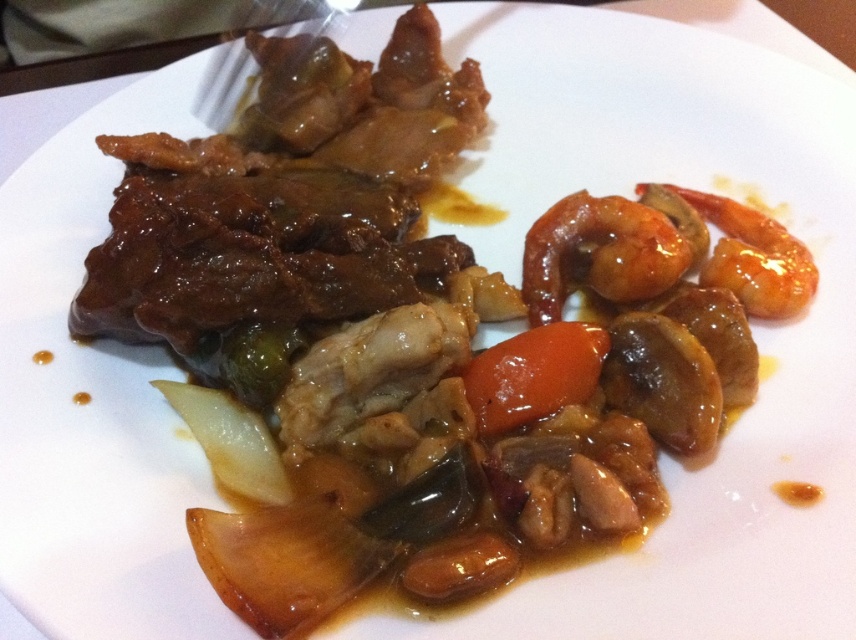
Question: In this image, where is glossy orange shrimp at upper right located relative to glossy orange shrimp at right?

Choices:
 (A) left
 (B) right

Answer: (A)

Question: Is glossy orange shrimp at upper right further to the viewer compared to metallic silver fork at upper left?

Choices:
 (A) no
 (B) yes

Answer: (A)

Question: Which point is closer to the camera taking this photo?

Choices:
 (A) (764, 237)
 (B) (131, 193)

Answer: (B)

Question: Estimate the real-world distances between objects in this image. Which object is farther from the glossy brown meat at upper left?

Choices:
 (A) glossy orange shrimp at upper right
 (B) glossy orange shrimp at right
 (C) glossy orange carrot at center

Answer: (B)

Question: Does glossy orange shrimp at upper right have a larger size compared to glossy orange carrot at center?

Choices:
 (A) yes
 (B) no

Answer: (A)

Question: Which point is farther to the camera?

Choices:
 (A) glossy orange carrot at center
 (B) glossy brown meat at upper left

Answer: (B)